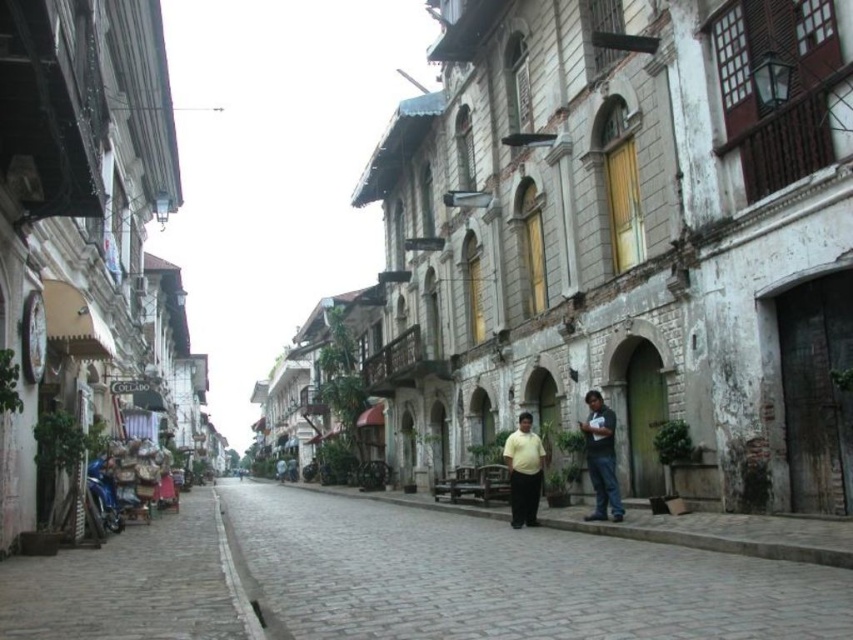
How much distance is there between yellow matte shirt at center and shiny blue motorcycle at lower left?

yellow matte shirt at center and shiny blue motorcycle at lower left are 30.53 meters apart from each other.

Looking at this image, which is above, yellow matte shirt at center or shiny blue motorcycle at lower left?

yellow matte shirt at center is above.

Who is more forward, (x=538, y=452) or (x=100, y=458)?

Point (x=538, y=452) is in front.

This screenshot has height=640, width=853. What are the coordinates of `yellow matte shirt at center` in the screenshot? It's located at (524, 472).

Which is above, shiny blue motorcycle at lower left or light blue fabric couple at center?

shiny blue motorcycle at lower left is above.

Between point (109, 472) and point (280, 458), which one is positioned in front?

Positioned in front is point (109, 472).

Locate an element on the screen. Image resolution: width=853 pixels, height=640 pixels. shiny blue motorcycle at lower left is located at coordinates (103, 493).

Is point (579, 428) positioned before point (517, 465)?

No.

Is point (602, 515) in front of point (503, 444)?

Yes, it is in front of point (503, 444).

I want to click on yellow cotton shirt at center, so click(601, 458).